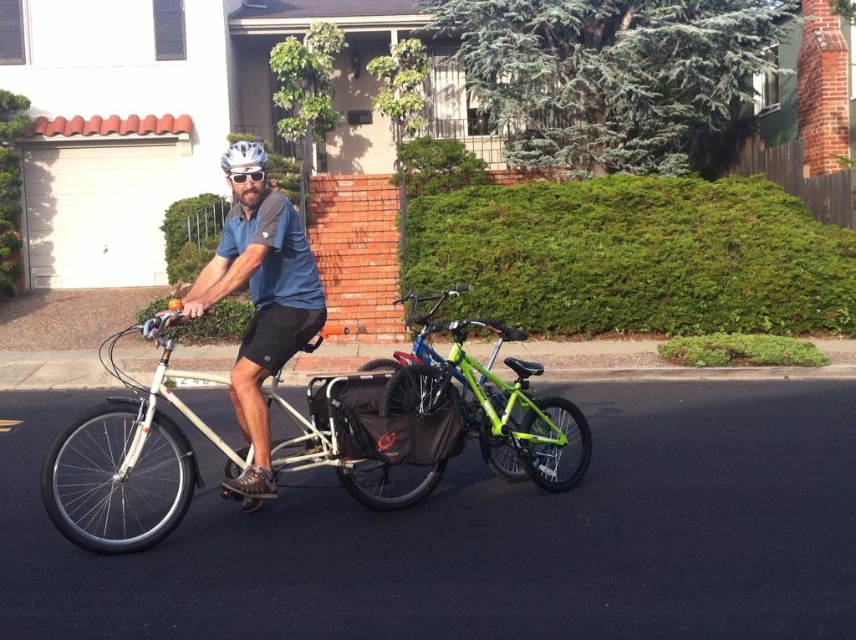
Question: Which point appears farthest from the camera in this image?

Choices:
 (A) (92, 419)
 (B) (226, 177)
 (C) (241, 429)
 (D) (516, 372)

Answer: (B)

Question: Is green matte bicycle at center wider than white matte bicycle helmet at center?

Choices:
 (A) no
 (B) yes

Answer: (A)

Question: Is white matte bicycle at center to the left of matte blue shirt at center from the viewer's perspective?

Choices:
 (A) yes
 (B) no

Answer: (A)

Question: Considering the real-world distances, which object is closest to the white matte bicycle helmet at center?

Choices:
 (A) white matte bicycle at center
 (B) green matte bicycle at center

Answer: (A)

Question: Which point appears farthest from the camera in this image?

Choices:
 (A) (565, 426)
 (B) (259, 493)
 (C) (259, 182)
 (D) (46, 474)

Answer: (A)

Question: Is white matte helmet at center closer to camera compared to white matte bicycle helmet at center?

Choices:
 (A) yes
 (B) no

Answer: (A)